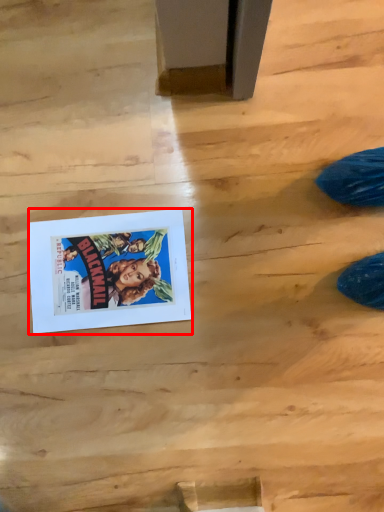
Question: Observing the image, what is the correct spatial positioning of comic book (annotated by the red box) in reference to wood?

Choices:
 (A) right
 (B) left

Answer: (B)